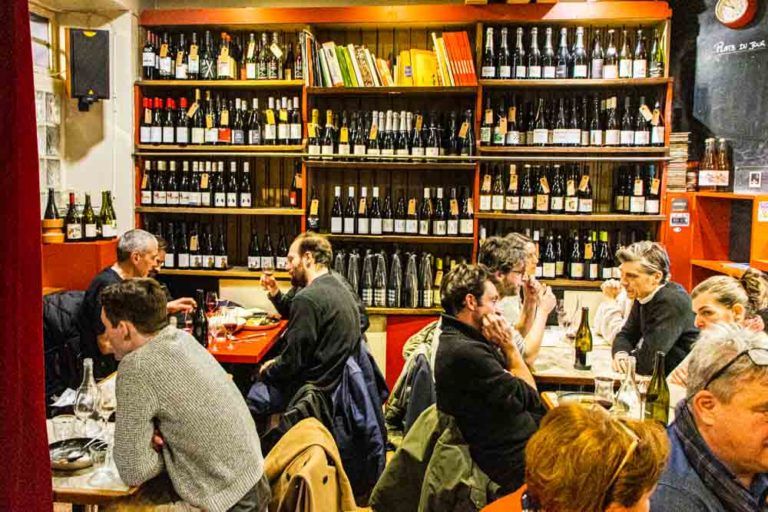
Locate an element on the screen. This screenshot has height=512, width=768. wine bottles is located at coordinates (227, 127), (391, 223), (644, 127), (568, 60), (199, 246), (565, 249).